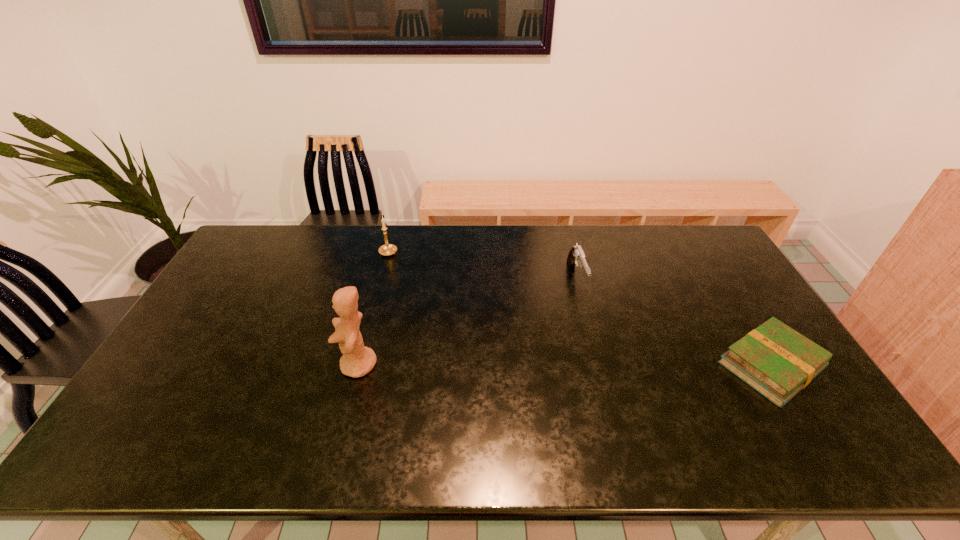
Find the location of a particular element. This screenshot has width=960, height=540. vacant area that lies between the farthest object and the second shortest object is located at coordinates (482, 266).

This screenshot has height=540, width=960. I want to click on free spot between the figurine and the third object from left to right, so click(468, 321).

Where is `vacant area between the figurine and the third nearest object`? vacant area between the figurine and the third nearest object is located at coordinates (468, 321).

Find the location of a particular element. vacant space in between the tallest object and the book is located at coordinates pyautogui.click(x=564, y=365).

Locate an element on the screen. empty space between the candle holder and the second object from right to left is located at coordinates (482, 266).

Where is `unoccupied position between the second object from right to left and the shortest object`? The height and width of the screenshot is (540, 960). unoccupied position between the second object from right to left and the shortest object is located at coordinates (674, 322).

Identify which object is located as the nearest to the rightmost object. Please provide its 2D coordinates. Your answer should be formatted as a tuple, i.e. [(x, y)], where the tuple contains the x and y coordinates of a point satisfying the conditions above.

[(576, 256)]

Point out which object is positioned as the nearest to the figurine. Please provide its 2D coordinates. Your answer should be formatted as a tuple, i.e. [(x, y)], where the tuple contains the x and y coordinates of a point satisfying the conditions above.

[(388, 249)]

Locate an element on the screen. This screenshot has height=540, width=960. vacant position in the image that satisfies the following two spatial constraints: 1. on the front side of the third object from left to right; 2. on the left side of the shortest object is located at coordinates (598, 366).

I want to click on vacant space that satisfies the following two spatial constraints: 1. on the front side of the rightmost object; 2. on the right side of the farthest object, so click(360, 366).